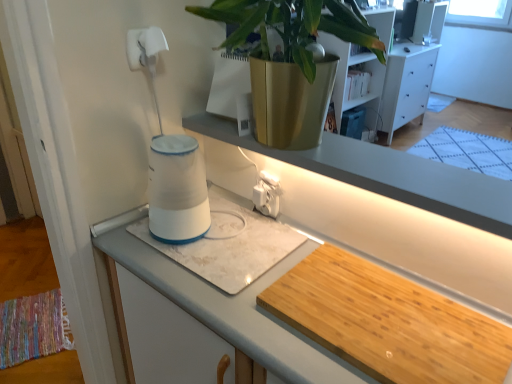
This screenshot has width=512, height=384. In order to click on vacant space in front of white plastic electric outlet at center in this screenshot , I will do `click(266, 248)`.